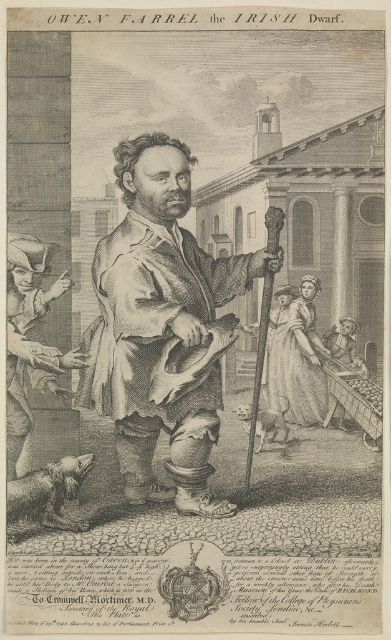
Question: Which of the following is the closest to the observer?

Choices:
 (A) (312, 356)
 (B) (86, 346)
 (C) (7, 330)

Answer: (C)

Question: Is matte brown coat at center above smooth skin figure at lower left?

Choices:
 (A) yes
 (B) no

Answer: (A)

Question: Which is farther from the smooth skin figure at lower left?

Choices:
 (A) matte brown coat at center
 (B) silky white gown at center

Answer: (B)

Question: Is matte brown coat at center below smooth skin figure at lower left?

Choices:
 (A) yes
 (B) no

Answer: (B)

Question: Is matte brown coat at center wider than smooth skin figure at lower left?

Choices:
 (A) yes
 (B) no

Answer: (A)

Question: Which point is farther to the camera?

Choices:
 (A) silky white gown at center
 (B) smooth skin figure at lower left

Answer: (A)